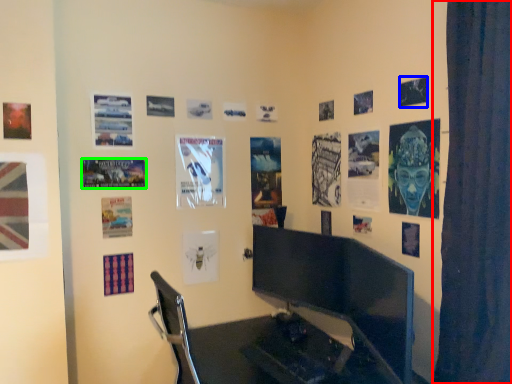
Question: Considering the real-world distances, which object is farthest from curtain (highlighted by a red box)? poster page (highlighted by a blue box) or poster page (highlighted by a green box)?

Choices:
 (A) poster page
 (B) poster page

Answer: (B)